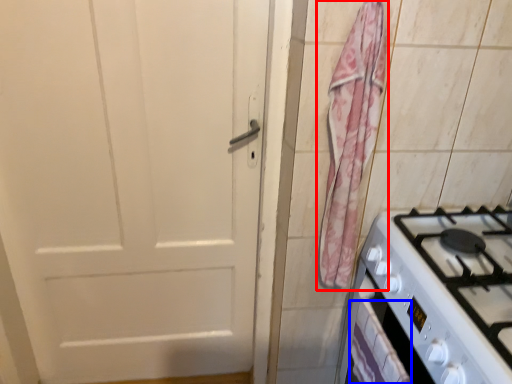
Question: Among these objects, which one is farthest to the camera, curtain (highlighted by a red box) or drawer (highlighted by a blue box)?

Choices:
 (A) curtain
 (B) drawer

Answer: (A)